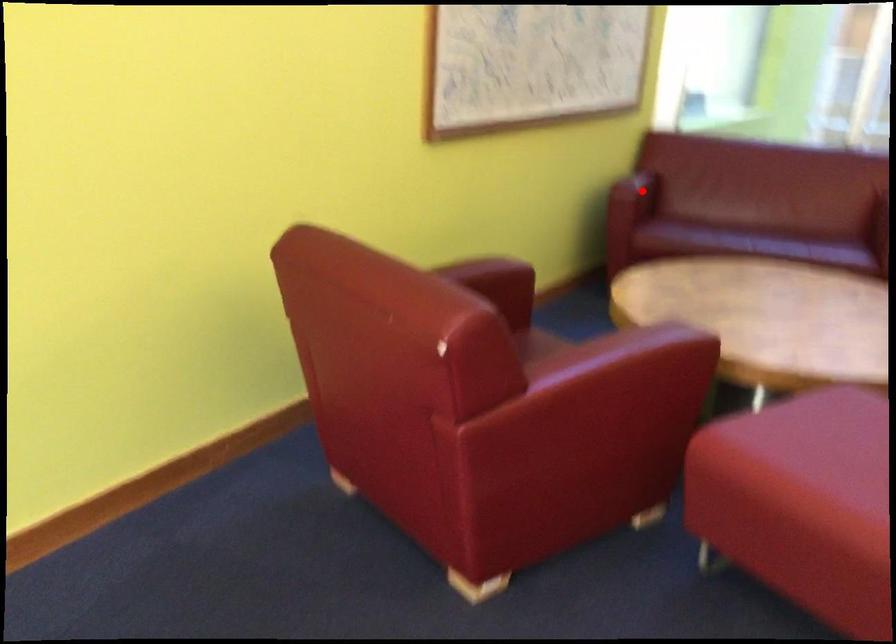
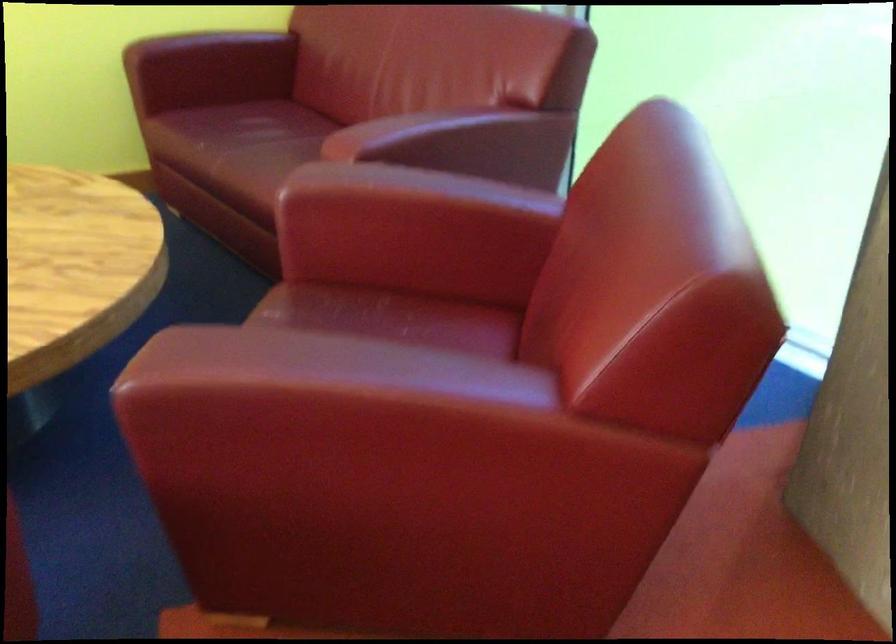
Question: I am providing you with two images of the same scene from different viewpoints. Image1 has a red point marked. In image2, the corresponding 3D location appears at what relative position? Reply with the corresponding letter.

Choices:
 (A) Closer
 (B) Farther

Answer: (A)